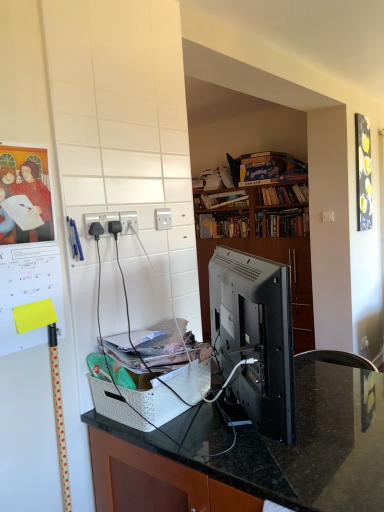
Question: Does hardcover book at center, the 5th book when ordered from top to bottom, have a larger size compared to black plastic power outlet at center, the first electric outlet positioned from the front?

Choices:
 (A) no
 (B) yes

Answer: (B)

Question: Does hardcover book at center, the 5th book when ordered from top to bottom, have a greater height compared to black plastic power outlet at center, which ranks as the third electric outlet in right-to-left order?

Choices:
 (A) yes
 (B) no

Answer: (A)

Question: From a real-world perspective, is hardcover book at center, the 5th book when ordered from top to bottom, on top of black plastic power outlet at center, the first electric outlet positioned from the front?

Choices:
 (A) no
 (B) yes

Answer: (A)

Question: Is hardcover book at center, the 5th book when ordered from top to bottom, positioned with its back to black plastic power outlet at center, acting as the 3th electric outlet starting from the back?

Choices:
 (A) no
 (B) yes

Answer: (A)

Question: From a real-world perspective, is hardcover book at center, which appears as the 2th book when ordered from the bottom, physically below black plastic power outlet at center, the first electric outlet positioned from the front?

Choices:
 (A) no
 (B) yes

Answer: (B)

Question: Does point (286, 211) appear closer or farther from the camera than point (168, 217)?

Choices:
 (A) closer
 (B) farther

Answer: (B)

Question: From the image's perspective, is hardcover book at center, marked as the sixth book in a top-to-bottom arrangement, above or below white plastic electric outlet at upper center, positioned as the third electric outlet in front-to-back order?

Choices:
 (A) below
 (B) above

Answer: (B)

Question: Looking at their shapes, would you say hardcover book at center, marked as the sixth book in a top-to-bottom arrangement, is wider or thinner than white plastic electric outlet at upper center, positioned as the 1th electric outlet in back-to-front order?

Choices:
 (A) thin
 (B) wide

Answer: (B)

Question: Is hardcover book at center, arranged as the 1th book when ordered from the bottom, in front of or behind white plastic electric outlet at upper center, positioned as the 1th electric outlet in back-to-front order, in the image?

Choices:
 (A) behind
 (B) front

Answer: (A)

Question: Relative to hardcover book at upper center, which is the 2th book from top to bottom, is satin black monitor at center in front or behind?

Choices:
 (A) front
 (B) behind

Answer: (A)

Question: Is satin black monitor at center to the left or to the right of hardcover book at upper center, the fifth book ordered from the bottom, in the image?

Choices:
 (A) right
 (B) left

Answer: (B)

Question: Is satin black monitor at center taller or shorter than hardcover book at upper center, the fifth book ordered from the bottom?

Choices:
 (A) tall
 (B) short

Answer: (A)

Question: Considering the positions of satin black monitor at center and hardcover book at upper center, which is the 2th book from top to bottom, in the image, is satin black monitor at center bigger or smaller than hardcover book at upper center, which is the 2th book from top to bottom,?

Choices:
 (A) big
 (B) small

Answer: (A)

Question: In the image, is black plastic power outlet at center, the first electric outlet positioned from the front, positioned in front of or behind white plastic basket at center?

Choices:
 (A) behind
 (B) front

Answer: (A)

Question: Based on their sizes in the image, would you say black plastic power outlet at center, acting as the 3th electric outlet starting from the back, is bigger or smaller than white plastic basket at center?

Choices:
 (A) big
 (B) small

Answer: (B)